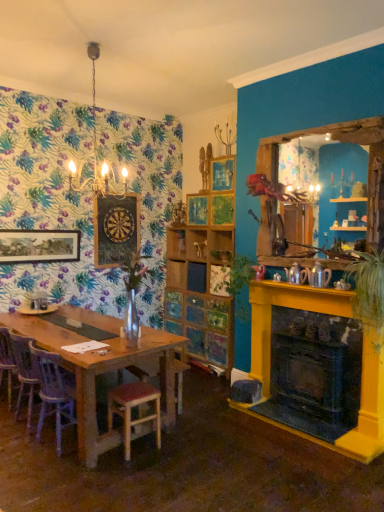
This screenshot has height=512, width=384. In order to click on vacant area that is in front of pine wood stool at lower left in this screenshot , I will do `click(128, 471)`.